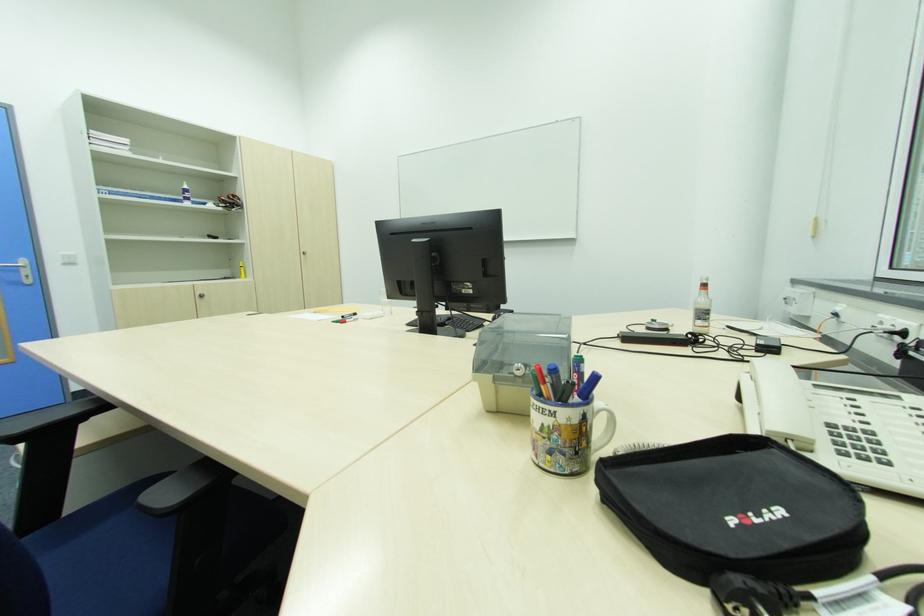
This screenshot has width=924, height=616. Find the location of `red pen`. red pen is located at coordinates (542, 383).